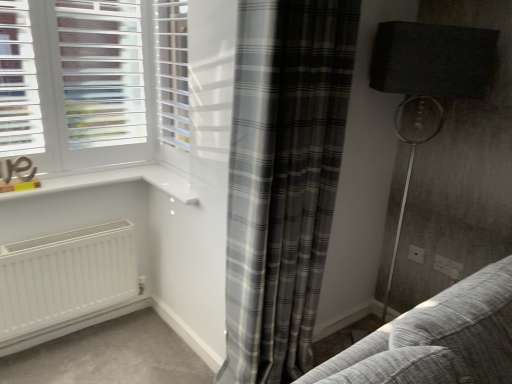
Image resolution: width=512 pixels, height=384 pixels. What are the coordinates of `gray plaid curtain at center` in the screenshot? It's located at point(283,179).

Measure the distance between white plastic electric outlet at lower right, acting as the 1th electric outlet starting from the back, and camera.

A distance of 7.07 feet exists between white plastic electric outlet at lower right, acting as the 1th electric outlet starting from the back, and camera.

Where is `white plastic electric outlet at lower right, the 1th electric outlet in the front-to-back sequence`? This screenshot has height=384, width=512. white plastic electric outlet at lower right, the 1th electric outlet in the front-to-back sequence is located at coordinates (448, 267).

Where is `white plastic blinds at upper center`? This screenshot has width=512, height=384. white plastic blinds at upper center is located at coordinates (172, 82).

The image size is (512, 384). What are the coordinates of `matte black lampshade at right` in the screenshot? It's located at (428, 78).

How different are the orientations of gray plaid curtain at center and white plastic blinds at upper center in degrees?

The facing directions of gray plaid curtain at center and white plastic blinds at upper center are 87.5 degrees apart.

Is gray plaid curtain at center not near white plastic blinds at upper center?

That's not correct — gray plaid curtain at center is a little close to white plastic blinds at upper center.

Who is bigger, gray plaid curtain at center or white plastic blinds at upper center?

Bigger between the two is gray plaid curtain at center.

Does gray plaid curtain at center lie behind white plastic blinds at upper center?

No, it is not.

Is white plastic electric outlet at lower right, which is the second electric outlet from left to right, aimed at white plastic blinds at upper center?

No.

How different are the orientations of white plastic electric outlet at lower right, the first electric outlet in the right-to-left sequence, and white plastic blinds at upper center in degrees?

The angle between the facing direction of white plastic electric outlet at lower right, the first electric outlet in the right-to-left sequence, and the facing direction of white plastic blinds at upper center is 0.552 degrees.

Does white plastic electric outlet at lower right, which is the second electric outlet from left to right, have a greater height compared to white plastic blinds at upper center?

In fact, white plastic electric outlet at lower right, which is the second electric outlet from left to right, may be shorter than white plastic blinds at upper center.

Considering the positions of objects white plastic electric outlet at lower right, the 1th electric outlet in the front-to-back sequence, and white plastic blinds at upper center in the image provided, who is more to the right, white plastic electric outlet at lower right, the 1th electric outlet in the front-to-back sequence, or white plastic blinds at upper center?

white plastic electric outlet at lower right, the 1th electric outlet in the front-to-back sequence, is more to the right.

From the image's perspective, which object appears higher, matte black lampshade at right or white plastic blinds at upper center?

white plastic blinds at upper center.

Can you confirm if matte black lampshade at right is taller than white plastic blinds at upper center?

Yes, matte black lampshade at right is taller than white plastic blinds at upper center.

This screenshot has height=384, width=512. Identify the location of lamp in front of the white plastic blinds at upper center. (428, 78).

Consider the image. Does white plastic electric outlet at lower right, the second electric outlet when ordered from right to left, appear on the left side of white plastic blinds at upper center?

→ No, white plastic electric outlet at lower right, the second electric outlet when ordered from right to left, is not to the left of white plastic blinds at upper center.

From a real-world perspective, is white plastic electric outlet at lower right, which appears as the second electric outlet when viewed from the front, positioned under white plastic blinds at upper center based on gravity?

Indeed, from a real-world perspective, white plastic electric outlet at lower right, which appears as the second electric outlet when viewed from the front, is positioned beneath white plastic blinds at upper center.

Could you tell me if white plastic electric outlet at lower right, which appears as the second electric outlet when viewed from the front, is facing white plastic blinds at upper center?

No, white plastic electric outlet at lower right, which appears as the second electric outlet when viewed from the front, is not facing towards white plastic blinds at upper center.

Looking at this image, who is bigger, white plastic electric outlet at lower right, the second electric outlet when ordered from right to left, or white plastic blinds at upper center?

Bigger between the two is white plastic blinds at upper center.

How much distance is there between white plastic electric outlet at lower right, the 1th electric outlet positioned from the left, and matte black lampshade at right?

They are 29.00 inches apart.

In the scene shown: Based on their sizes in the image, would you say white plastic electric outlet at lower right, which appears as the second electric outlet when viewed from the front, is bigger or smaller than matte black lampshade at right?

Clearly, white plastic electric outlet at lower right, which appears as the second electric outlet when viewed from the front, is smaller in size than matte black lampshade at right.

From the image's perspective, between white plastic electric outlet at lower right, the second electric outlet when ordered from right to left, and matte black lampshade at right, who is located below?

white plastic electric outlet at lower right, the second electric outlet when ordered from right to left, from the image's perspective.

Considering the relative sizes of gray plaid curtain at center and white plastic electric outlet at lower right, the 1th electric outlet positioned from the left, in the image provided, is gray plaid curtain at center taller than white plastic electric outlet at lower right, the 1th electric outlet positioned from the left,?

Yes.

Is the position of gray plaid curtain at center more distant than that of white plastic electric outlet at lower right, which appears as the second electric outlet when viewed from the front?

No, gray plaid curtain at center is closer to the viewer.

Is point (287, 275) closer or farther from the camera than point (419, 248)?

Clearly, point (287, 275) is closer to the camera than point (419, 248).

Between gray plaid curtain at center and white plastic electric outlet at lower right, the second electric outlet when ordered from right to left, which one has smaller size?

With smaller size is white plastic electric outlet at lower right, the second electric outlet when ordered from right to left.

Is white plastic blinds at upper center facing towards white plastic electric outlet at lower right, acting as the 1th electric outlet starting from the back?

No, white plastic blinds at upper center is not facing towards white plastic electric outlet at lower right, acting as the 1th electric outlet starting from the back.

Which of these two, white plastic blinds at upper center or white plastic electric outlet at lower right, which appears as the second electric outlet when viewed from the front, stands taller?

white plastic blinds at upper center is taller.

Does white plastic blinds at upper center have a smaller size compared to white plastic electric outlet at lower right, which appears as the second electric outlet when viewed from the front?

Actually, white plastic blinds at upper center might be larger than white plastic electric outlet at lower right, which appears as the second electric outlet when viewed from the front.

The height and width of the screenshot is (384, 512). I want to click on the 1st electric outlet positioned below the white plastic blinds at upper center (from the image's perspective), so click(416, 254).

The height and width of the screenshot is (384, 512). Find the location of `curtain located on the right of white plastic blinds at upper center`. curtain located on the right of white plastic blinds at upper center is located at coordinates (283, 179).

At what (x,y) coordinates should I click in order to perform the action: click on screen door in front of the white plastic electric outlet at lower right, the first electric outlet in the right-to-left sequence. Please return your answer as a coordinate pair (x, y). The image size is (512, 384). Looking at the image, I should click on (172, 82).

When comparing their distances from gray plaid curtain at center, does white plastic electric outlet at lower right, the first electric outlet in the right-to-left sequence, or white plastic blinds at upper center seem further?

white plastic electric outlet at lower right, the first electric outlet in the right-to-left sequence, is positioned further to the anchor gray plaid curtain at center.

When comparing their distances from white plastic electric outlet at lower right, acting as the 1th electric outlet starting from the back, does matte black lampshade at right or white plastic blinds at upper center seem closer?

The object closer to white plastic electric outlet at lower right, acting as the 1th electric outlet starting from the back, is matte black lampshade at right.

Looking at the image, which one is located closer to matte black lampshade at right, white plastic blinds at upper center or white plastic electric outlet at lower right, which appears as the second electric outlet when viewed from the front?

white plastic electric outlet at lower right, which appears as the second electric outlet when viewed from the front.

Based on their spatial positions, is white plastic blinds at upper center or white plastic electric outlet at lower right, the 1th electric outlet positioned from the left, closer to gray plaid curtain at center?

Based on the image, white plastic blinds at upper center appears to be nearer to gray plaid curtain at center.

When comparing their distances from matte black lampshade at right, does white plastic electric outlet at lower right, which is counted as the 2th electric outlet, starting from the back, or gray plaid curtain at center seem closer?

gray plaid curtain at center lies closer to matte black lampshade at right than the other object.

From the picture: Considering their positions, is white plastic electric outlet at lower right, the 1th electric outlet positioned from the left, positioned closer to white plastic blinds at upper center than gray plaid curtain at center?

Among the two, gray plaid curtain at center is located nearer to white plastic blinds at upper center.

In the scene shown: From the image, which object appears to be nearer to white plastic blinds at upper center, gray plaid curtain at center or matte black lampshade at right?

gray plaid curtain at center lies closer to white plastic blinds at upper center than the other object.

Considering their positions, is white plastic electric outlet at lower right, which appears as the second electric outlet when viewed from the front, positioned closer to white plastic electric outlet at lower right, the 1th electric outlet in the front-to-back sequence, than matte black lampshade at right?

white plastic electric outlet at lower right, which appears as the second electric outlet when viewed from the front, lies closer to white plastic electric outlet at lower right, the 1th electric outlet in the front-to-back sequence, than the other object.

Find the location of a particular element. This screenshot has height=384, width=512. lamp between gray plaid curtain at center and white plastic electric outlet at lower right, which appears as the second electric outlet when viewed from the front, from front to back is located at coordinates (x=428, y=78).

At what (x,y) coordinates should I click in order to perform the action: click on electric outlet between gray plaid curtain at center and white plastic electric outlet at lower right, which appears as the second electric outlet when viewed from the front, along the z-axis. Please return your answer as a coordinate pair (x, y). This screenshot has width=512, height=384. Looking at the image, I should click on [448, 267].

The image size is (512, 384). Identify the location of lamp located between gray plaid curtain at center and white plastic electric outlet at lower right, which is counted as the 2th electric outlet, starting from the back, in the depth direction. (428, 78).

Identify the location of curtain located between white plastic blinds at upper center and white plastic electric outlet at lower right, which is the second electric outlet from left to right, in the left-right direction. This screenshot has height=384, width=512. (283, 179).